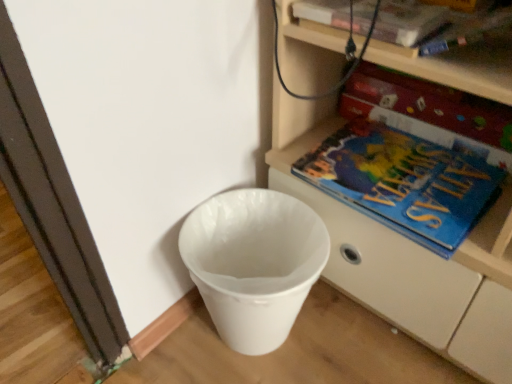
Question: Is there a large distance between white plastic waste bin at lower left and blue matte atlas at lower right?

Choices:
 (A) no
 (B) yes

Answer: (A)

Question: Does white plastic waste bin at lower left touch blue matte atlas at lower right?

Choices:
 (A) yes
 (B) no

Answer: (B)

Question: Is white plastic waste bin at lower left closer to camera compared to blue matte atlas at lower right?

Choices:
 (A) yes
 (B) no

Answer: (A)

Question: Does white plastic waste bin at lower left have a smaller size compared to blue matte atlas at lower right?

Choices:
 (A) no
 (B) yes

Answer: (A)

Question: Considering the relative sizes of white plastic waste bin at lower left and blue matte atlas at lower right in the image provided, is white plastic waste bin at lower left shorter than blue matte atlas at lower right?

Choices:
 (A) yes
 (B) no

Answer: (B)

Question: Would you say blue matte atlas at lower right is to the left or to the right of white plastic waste bin at lower left in the picture?

Choices:
 (A) right
 (B) left

Answer: (A)

Question: Considering the positions of blue matte atlas at lower right and white plastic waste bin at lower left in the image, is blue matte atlas at lower right wider or thinner than white plastic waste bin at lower left?

Choices:
 (A) thin
 (B) wide

Answer: (A)

Question: From their relative heights in the image, would you say blue matte atlas at lower right is taller or shorter than white plastic waste bin at lower left?

Choices:
 (A) tall
 (B) short

Answer: (B)

Question: From a real-world perspective, relative to white plastic waste bin at lower left, is blue matte atlas at lower right vertically above or below?

Choices:
 (A) below
 (B) above

Answer: (B)

Question: From a real-world perspective, is white plastic waste bin at lower left physically located above or below white plastic shelf at lower right?

Choices:
 (A) above
 (B) below

Answer: (B)

Question: From the image's perspective, is white plastic waste bin at lower left located above or below white plastic shelf at lower right?

Choices:
 (A) above
 (B) below

Answer: (B)

Question: In terms of height, does white plastic waste bin at lower left look taller or shorter compared to white plastic shelf at lower right?

Choices:
 (A) short
 (B) tall

Answer: (A)

Question: In the image, is white plastic waste bin at lower left positioned in front of or behind white plastic shelf at lower right?

Choices:
 (A) front
 (B) behind

Answer: (B)

Question: From a real-world perspective, is blue matte paperback book at right, which ranks as the 2th paperback book in top-to-bottom order, positioned above or below blue matte atlas at lower right?

Choices:
 (A) above
 (B) below

Answer: (A)

Question: Looking at their shapes, would you say blue matte paperback book at right, which ranks as the 2th paperback book in top-to-bottom order, is wider or thinner than blue matte atlas at lower right?

Choices:
 (A) wide
 (B) thin

Answer: (B)